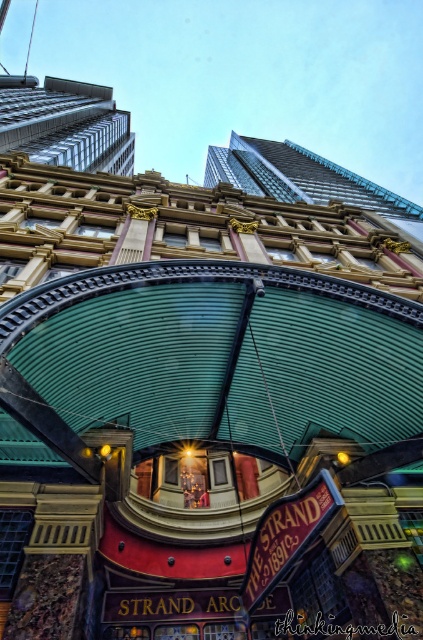
Is point (118, 170) positioned before point (307, 196)?

No, (118, 170) is further to viewer.

How much distance is there between glassy steel skyscraper at upper left and green corrugated metal canopy at upper center?

The distance of glassy steel skyscraper at upper left from green corrugated metal canopy at upper center is 66.90 meters.

Find the location of a particular element. glassy steel skyscraper at upper left is located at coordinates (65, 124).